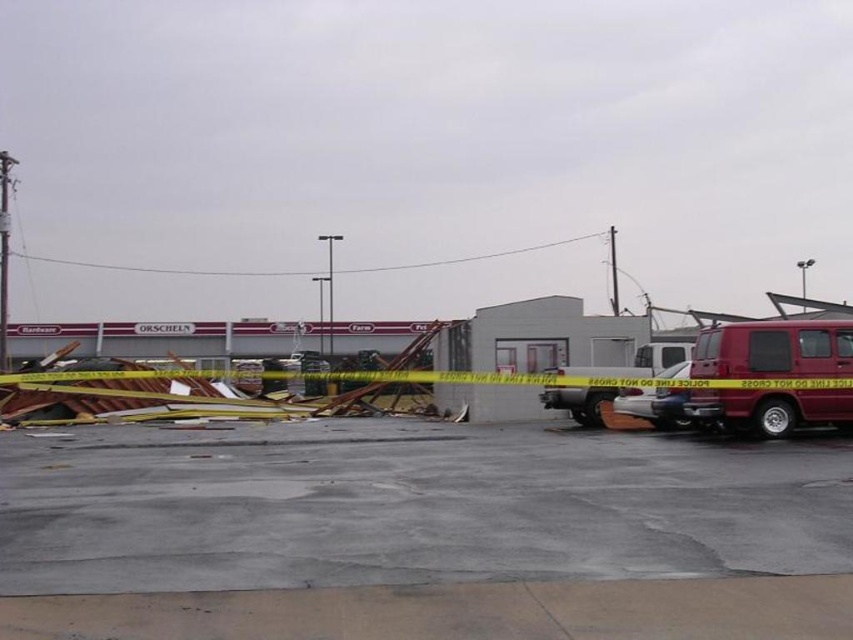
Question: Among these objects, which one is farthest from the camera?

Choices:
 (A) gray concrete pavement at center
 (B) matte red van at right
 (C) metallic silver van at center

Answer: (C)

Question: Does gray concrete pavement at center have a smaller size compared to matte red van at right?

Choices:
 (A) yes
 (B) no

Answer: (B)

Question: In this image, where is gray concrete pavement at center located relative to matte red van at right?

Choices:
 (A) left
 (B) right

Answer: (A)

Question: Which object is positioned closest to the metallic silver van at center?

Choices:
 (A) matte red van at right
 (B) gray concrete pavement at center

Answer: (A)

Question: Among these objects, which one is farthest from the camera?

Choices:
 (A) matte red van at right
 (B) gray concrete pavement at center

Answer: (A)

Question: Does gray concrete pavement at center lie in front of matte red van at right?

Choices:
 (A) yes
 (B) no

Answer: (A)